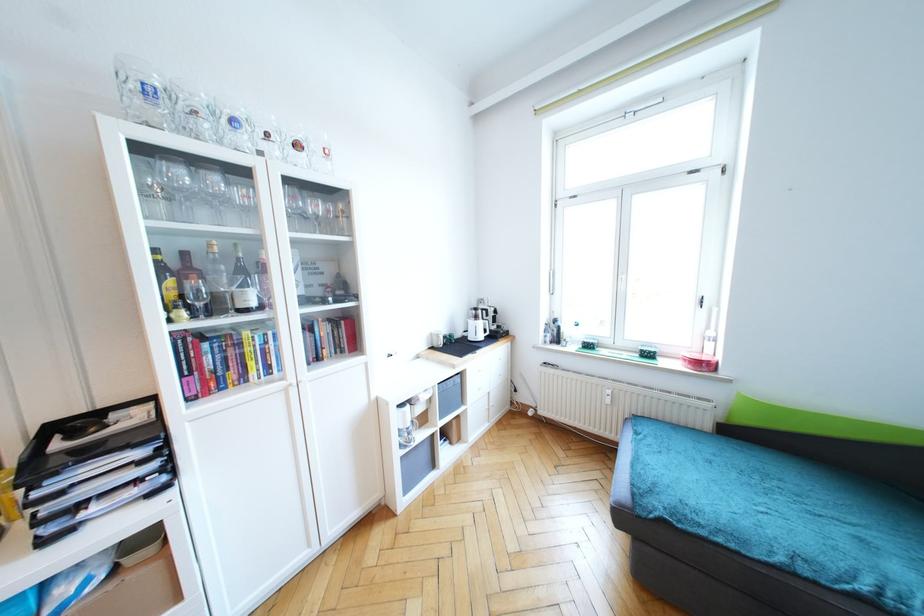
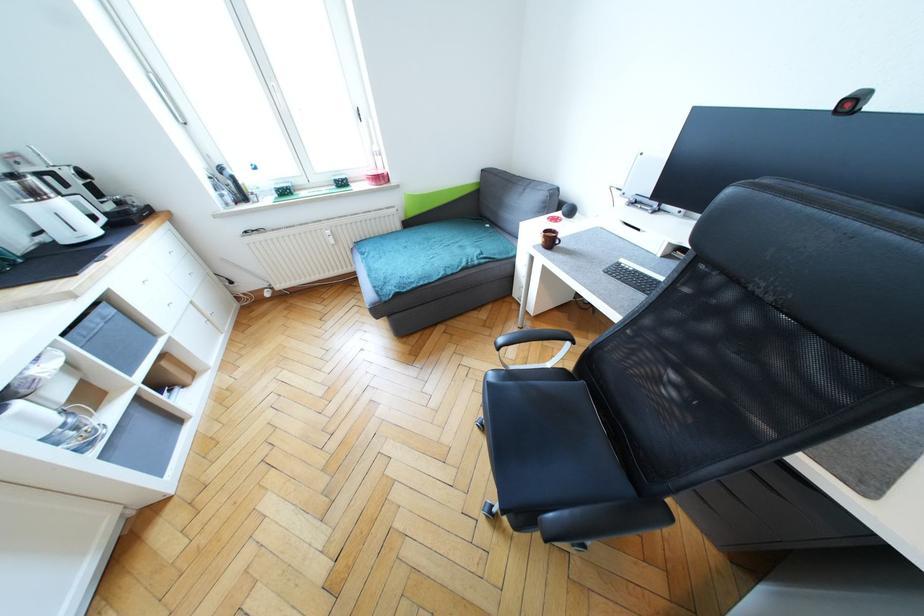
In the second image, find the point that corresponds to (456,391) in the first image.

(116, 329)